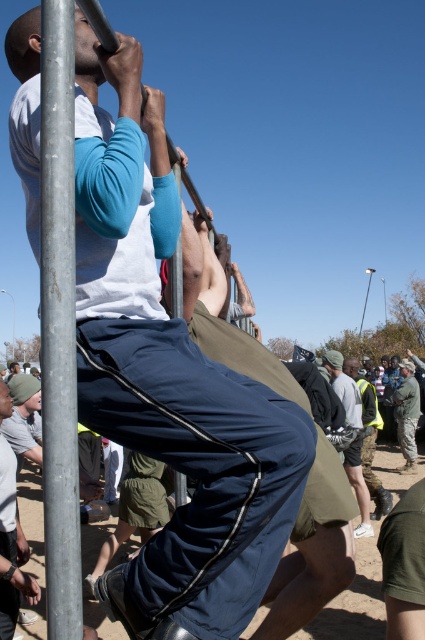
Question: Is gray fabric shorts at center positioned at the back of camouflage fabric uniform at center?

Choices:
 (A) yes
 (B) no

Answer: (B)

Question: Among these objects, which one is nearest to the camera?

Choices:
 (A) matte blue track pants at center
 (B) metallic pole at center

Answer: (B)

Question: Estimate the real-world distances between objects in this image. Which object is closer to the matte blue track pants at center?

Choices:
 (A) metallic pole at center
 (B) gray fabric shorts at center
 (C) camouflage fabric uniform at center

Answer: (A)

Question: Which point is closer to the camera?

Choices:
 (A) gray fabric shorts at center
 (B) matte blue track pants at center
 (C) camouflage fabric uniform at center
 (D) metallic pole at center

Answer: (D)

Question: Is gray fabric shorts at center above camouflage fabric uniform at center?

Choices:
 (A) yes
 (B) no

Answer: (A)

Question: Is metallic pole at center wider than gray fabric shorts at center?

Choices:
 (A) yes
 (B) no

Answer: (B)